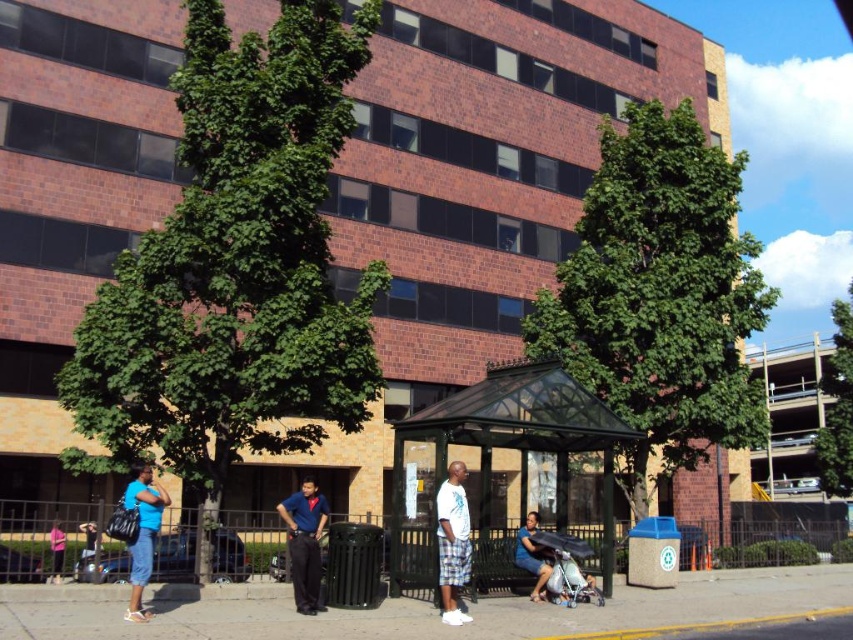
You are standing on the sidewalk in front of the building and want to take a photo that includes both the point at [850,419] and the point at [57,532]. Which point should you focus on first to ensure both are in focus?

You should focus on the point at [57,532] first because it is closer to you than the point at [850,419], which is further away. This ensures the closer point is in focus, and the further point will also be within the depth of field.

You are standing on the sidewalk and notice the green leafy tree at right and the blue denim shorts at lower left. Which object is above the other?

A: The green leafy tree at right is positioned over the blue denim shorts at lower left, meaning it is above the shorts.

You are standing on the sidewalk and want to walk from the blue denim shorts at lower left to the green leafy tree at center. How many steps would you need to take if each step covers about 2.5 feet?

The distance between the blue denim shorts at lower left and the green leafy tree at center is 56.64 feet. Dividing this by 2.5 feet per step gives approximately 22.656 steps. Since you can only take whole steps, you would need to take 23 steps to reach the green leafy tree at center from the blue denim shorts at lower left.